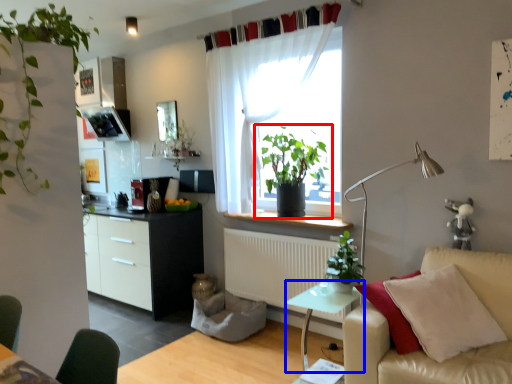
Question: Among these objects, which one is farthest to the camera, houseplant (highlighted by a red box) or table (highlighted by a blue box)?

Choices:
 (A) houseplant
 (B) table

Answer: (A)